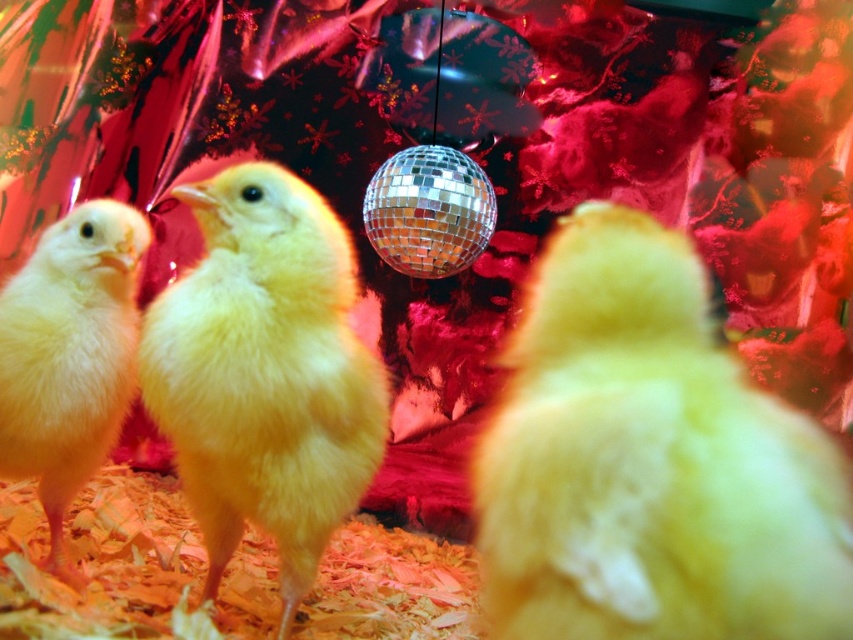
Which is below, yellow fluffy chick at center or shiny metallic disco ball at center?

yellow fluffy chick at center

Does point (579, 508) come farther from viewer compared to point (489, 193)?

No, (579, 508) is in front of (489, 193).

Locate an element on the screen. yellow fluffy chick at center is located at coordinates 650,461.

Does yellow fluffy chick at center have a lesser height compared to yellow fluffy chicken at center?

Indeed, yellow fluffy chick at center has a lesser height compared to yellow fluffy chicken at center.

Is point (489, 483) closer to camera compared to point (229, 458)?

That is True.

What are the coordinates of `yellow fluffy chick at center` in the screenshot? It's located at (650, 461).

Is yellow fluffy chick at center to the left of yellow fluffy chick at left from the viewer's perspective?

In fact, yellow fluffy chick at center is to the right of yellow fluffy chick at left.

Between yellow fluffy chick at center and yellow fluffy chick at left, which one is positioned lower?

yellow fluffy chick at left is lower down.

Does point (699, 564) come behind point (94, 433)?

That is False.

Identify the location of yellow fluffy chick at center. (650, 461).